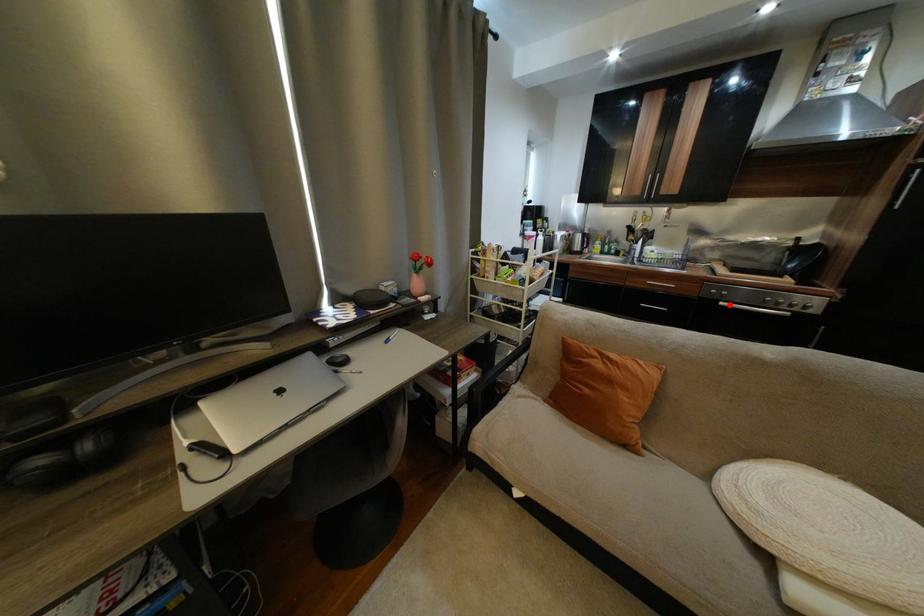
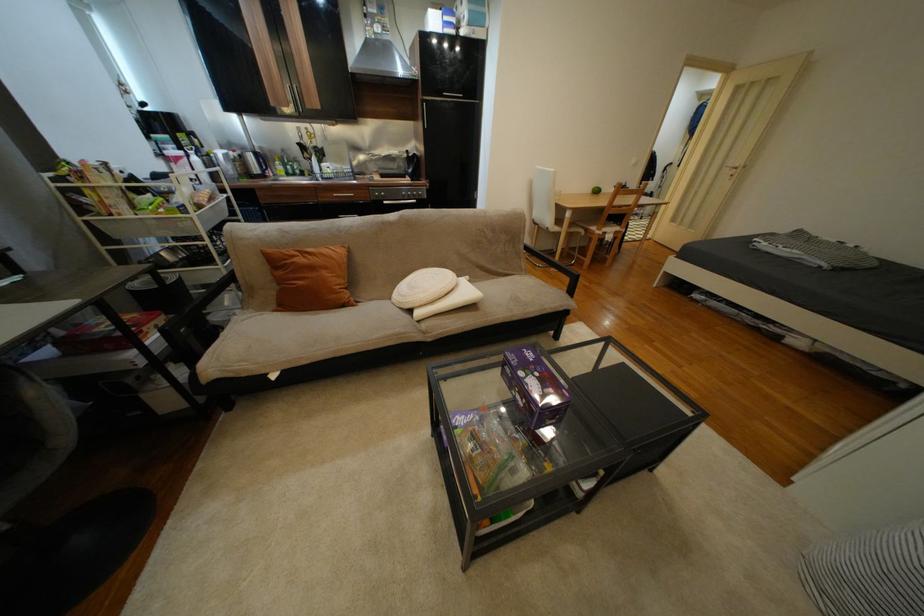
The point at the highlighted location is marked in the first image. Where is the corresponding point in the second image?

(393, 204)